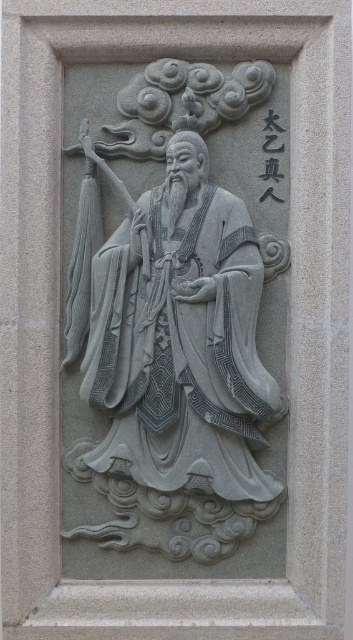
Question: Can you confirm if gray stone figure at center is positioned below black stone text at upper right?

Choices:
 (A) no
 (B) yes

Answer: (B)

Question: Is gray stone figure at center in front of black stone text at upper right?

Choices:
 (A) yes
 (B) no

Answer: (A)

Question: Can you confirm if gray stone figure at center is bigger than black stone text at upper right?

Choices:
 (A) no
 (B) yes

Answer: (B)

Question: Which point is farther to the camera?

Choices:
 (A) (265, 177)
 (B) (115, 214)

Answer: (B)